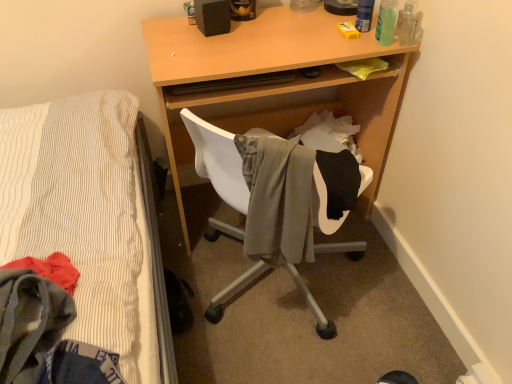
Identify the location of spots to the right of matte black speaker at upper center. Image resolution: width=512 pixels, height=384 pixels. (267, 30).